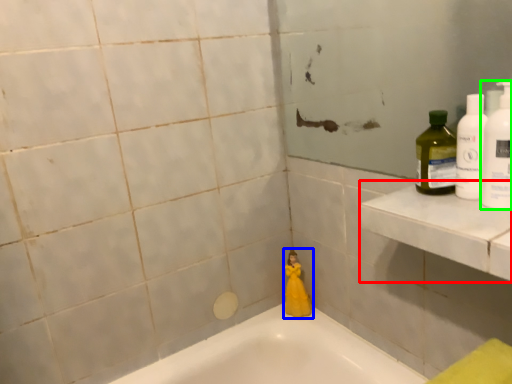
Question: Which object is positioned closest to ledge (highlighted by a red box)? Select from toy (highlighted by a blue box) and cleaning product (highlighted by a green box).

Choices:
 (A) toy
 (B) cleaning product

Answer: (B)